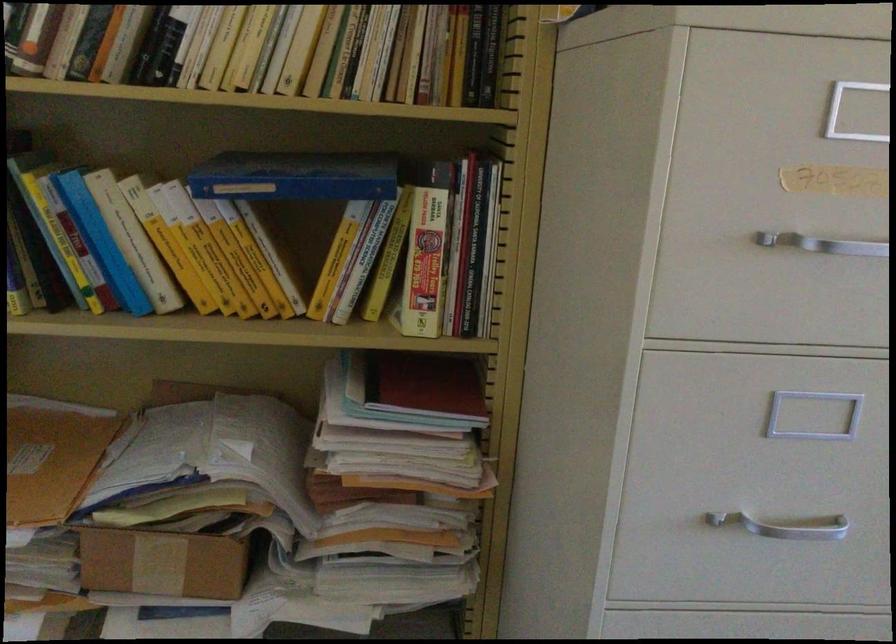
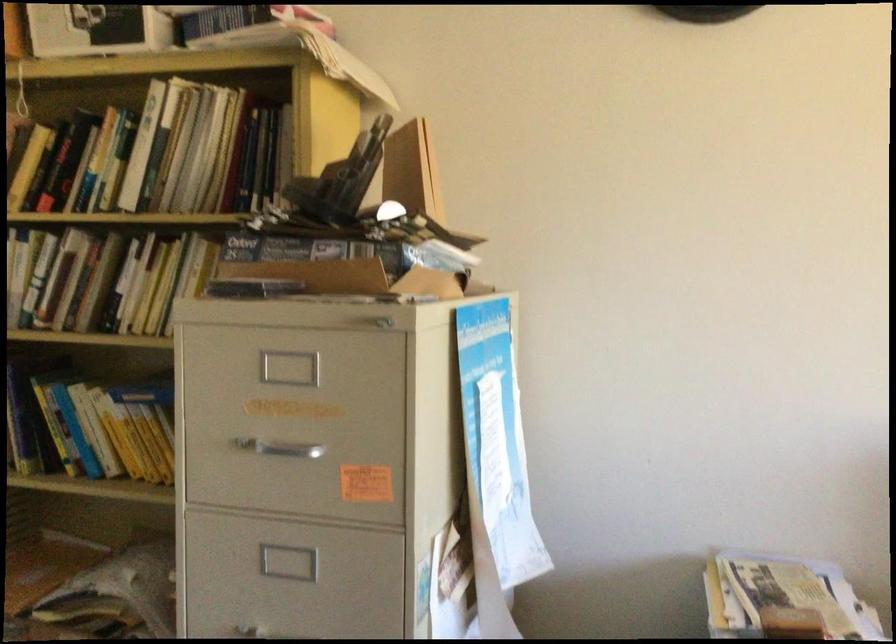
Question: The images are taken continuously from a first-person perspective. In which direction is your viewpoint rotating?

Choices:
 (A) Left
 (B) Right
 (C) Up
 (D) Down

Answer: (A)